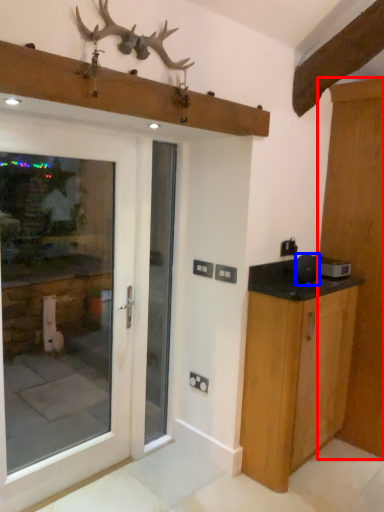
Question: Among these objects, which one is farthest to the camera, door (highlighted by a red box) or appliance (highlighted by a blue box)?

Choices:
 (A) door
 (B) appliance

Answer: (B)